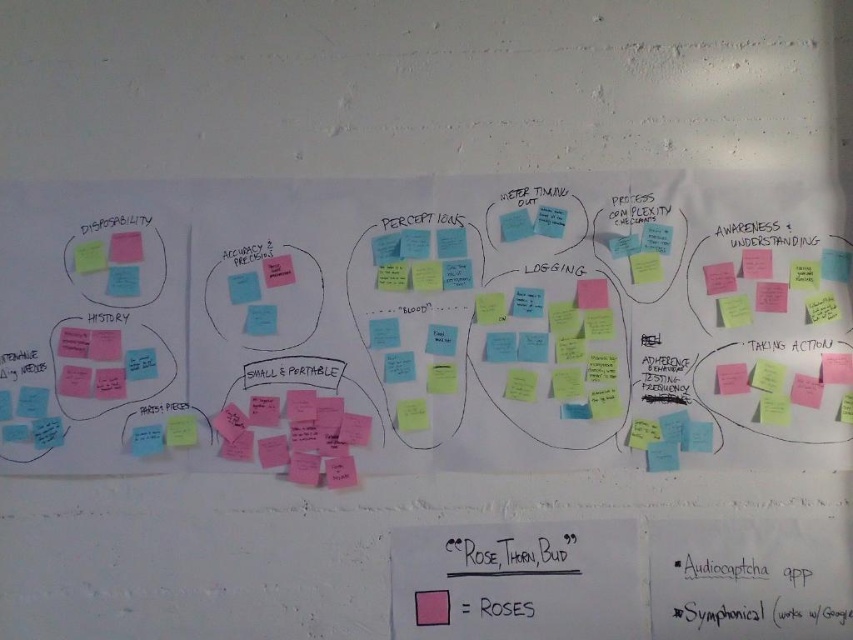
Question: Which point is farther to the camera?

Choices:
 (A) (190, 436)
 (B) (426, 621)

Answer: (B)

Question: Is pink paper at center further to the viewer compared to pink matte sticky note at upper left?

Choices:
 (A) no
 (B) yes

Answer: (B)

Question: Which object appears farthest from the camera in this image?

Choices:
 (A) green matte sticky note at upper left
 (B) pink matte sticky note at upper left
 (C) pink paper at center

Answer: (C)

Question: In this image, where is pink sticky notes at left located relative to pink paper at lower left?

Choices:
 (A) above
 (B) below

Answer: (A)

Question: Based on their relative distances, which object is farther from the pink paper at center?

Choices:
 (A) pink matte sticky note at upper left
 (B) pink paper at lower left

Answer: (A)

Question: Is pink matte sticky note at upper left smaller than pink paper at lower left?

Choices:
 (A) yes
 (B) no

Answer: (B)